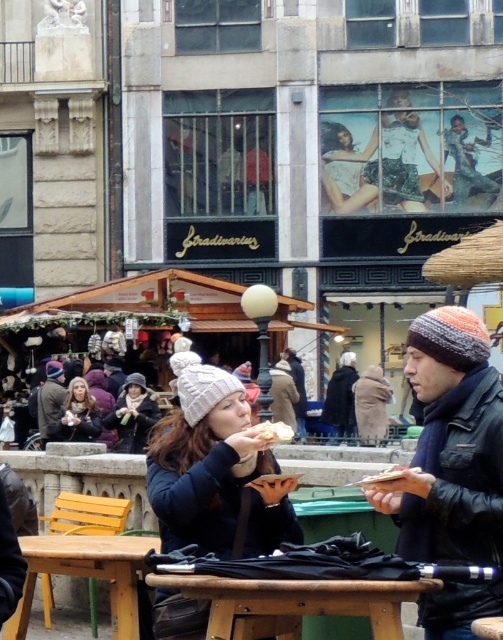
Who is more distant from viewer, (x=26, y=579) or (x=389, y=477)?

The point (x=26, y=579) is more distant.

Does wooden table at lower center come in front of golden crisp pastry at center?

No, it is not.

Describe the element at coordinates (87, 573) in the screenshot. Image resolution: width=503 pixels, height=640 pixels. I see `wooden table at lower center` at that location.

Find the location of a particular element. Image resolution: width=503 pixels, height=640 pixels. wooden table at lower center is located at coordinates (87, 573).

Is point (28, 586) in front of point (67, 410)?

Yes, point (28, 586) is closer to viewer.

Is point (44, 536) farther from camera compared to point (67, 387)?

No.

The image size is (503, 640). I want to click on wooden table at lower center, so click(87, 573).

Is point (390, 492) more distant than point (208, 426)?

No, (390, 492) is closer to viewer.

At what (x,y) coordinates should I click in order to perform the action: click on leather jacket at right. Please return your answer as a coordinate pair (x, y). Looking at the image, I should click on tap(452, 468).